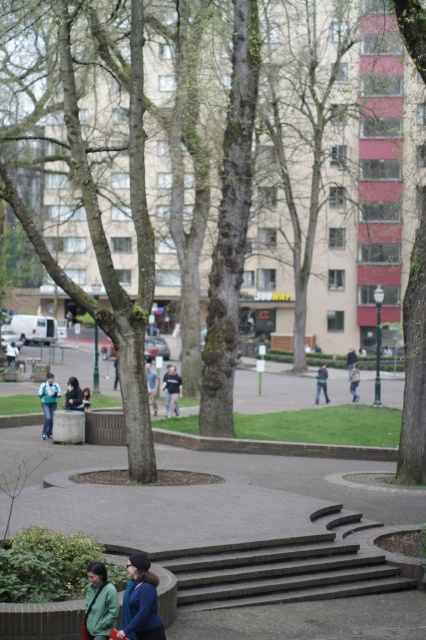
Which is below, teal fabric backpack at center or dark gray shirt at center?

Positioned lower is teal fabric backpack at center.

Between teal fabric backpack at center and dark gray shirt at center, which one appears on the left side from the viewer's perspective?

Positioned to the left is teal fabric backpack at center.

I want to click on teal fabric backpack at center, so click(x=48, y=403).

Is brown wooden stairs at lower center smaller than green matte jacket at lower left?

No.

Is point (215, 572) closer to camera compared to point (88, 604)?

No, it is not.

You are a GUI agent. You are given a task and a screenshot of the screen. Output one action in this format:
    pyautogui.click(x=<x>, y=<y>)
    Task: Click on the brown wooden stairs at lower center
    This screenshot has width=426, height=640.
    Given the screenshot: What is the action you would take?
    [279, 572]

Is matte black backpack at center positioned at the back of dark blue jeans at center?

No, matte black backpack at center is closer to the viewer.

Which is above, matte black backpack at center or dark blue jeans at center?

matte black backpack at center

This screenshot has height=640, width=426. What do you see at coordinates (48, 403) in the screenshot?
I see `matte black backpack at center` at bounding box center [48, 403].

The image size is (426, 640). I want to click on matte black backpack at center, so click(48, 403).